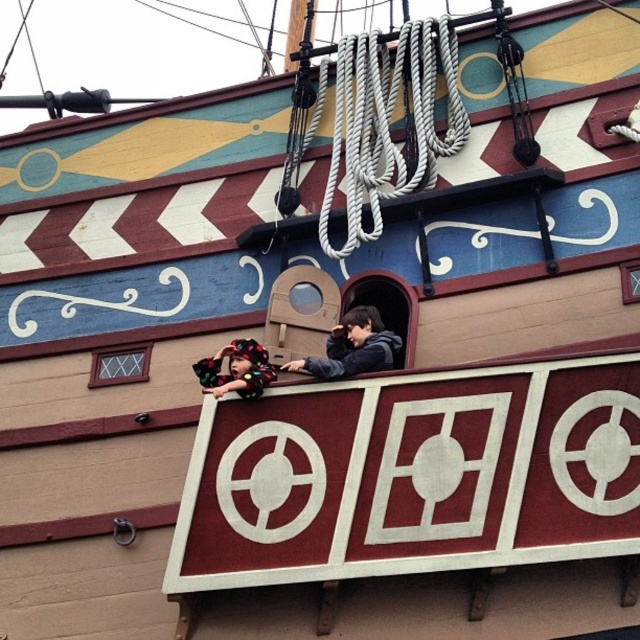
Between dark gray hoodie at center and fluffy hair at upper center, which one appears on the left side from the viewer's perspective?

Positioned to the left is fluffy hair at upper center.

Can you confirm if dark gray hoodie at center is positioned above fluffy hair at upper center?

Indeed, dark gray hoodie at center is positioned over fluffy hair at upper center.

Which is in front, point (349, 324) or point (230, 376)?

Point (230, 376)

At what (x,y) coordinates should I click in order to perform the action: click on dark gray hoodie at center. Please return your answer as a coordinate pair (x, y). Looking at the image, I should click on (353, 348).

Can you confirm if fluffy multicolored blanket at center is smaller than fluffy hair at upper center?

Incorrect, fluffy multicolored blanket at center is not smaller in size than fluffy hair at upper center.

Between fluffy multicolored blanket at center and fluffy hair at upper center, which one is positioned lower?

fluffy hair at upper center is below.

Is point (320, 368) positioned after point (269, 380)?

No.

Where is `fluffy multicolored blanket at center`? The width and height of the screenshot is (640, 640). fluffy multicolored blanket at center is located at coordinates (305, 356).

Does fluffy multicolored blanket at center appear on the left side of dark gray hoodie at center?

Indeed, fluffy multicolored blanket at center is positioned on the left side of dark gray hoodie at center.

Between fluffy multicolored blanket at center and dark gray hoodie at center, which one is positioned lower?

dark gray hoodie at center is below.

Does point (372, 369) come in front of point (326, 353)?

Yes, it is in front of point (326, 353).

Find the location of a particular element. Image resolution: width=640 pixels, height=640 pixels. fluffy multicolored blanket at center is located at coordinates (305, 356).